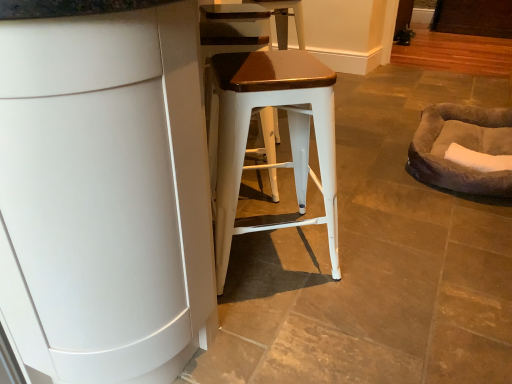
Question: Are white matte cabinet at center and matte white stool at center beside each other?

Choices:
 (A) yes
 (B) no

Answer: (B)

Question: Could matte white stool at center be considered to be inside white matte cabinet at center?

Choices:
 (A) no
 (B) yes

Answer: (B)

Question: From the image's perspective, is white matte cabinet at center beneath matte white stool at center?

Choices:
 (A) no
 (B) yes

Answer: (A)

Question: Considering the relative sizes of white matte cabinet at center and matte white stool at center in the image provided, is white matte cabinet at center smaller than matte white stool at center?

Choices:
 (A) yes
 (B) no

Answer: (B)

Question: Can you confirm if white matte cabinet at center is thinner than matte white stool at center?

Choices:
 (A) yes
 (B) no

Answer: (B)

Question: Can you confirm if white matte cabinet at center is bigger than matte white stool at center?

Choices:
 (A) no
 (B) yes

Answer: (B)

Question: Is matte white stool at center to the left of brown fuzzy bean bag at right from the viewer's perspective?

Choices:
 (A) yes
 (B) no

Answer: (A)

Question: Is matte white stool at center to the right of brown fuzzy bean bag at right from the viewer's perspective?

Choices:
 (A) yes
 (B) no

Answer: (B)

Question: From a real-world perspective, is matte white stool at center physically above brown fuzzy bean bag at right?

Choices:
 (A) yes
 (B) no

Answer: (A)

Question: From the image's perspective, is matte white stool at center beneath brown fuzzy bean bag at right?

Choices:
 (A) yes
 (B) no

Answer: (A)

Question: From the image's perspective, is matte white stool at center above brown fuzzy bean bag at right?

Choices:
 (A) yes
 (B) no

Answer: (B)

Question: Is matte white stool at center turned away from brown fuzzy bean bag at right?

Choices:
 (A) no
 (B) yes

Answer: (A)

Question: Can you confirm if white matte cabinet at center is taller than brown fuzzy bean bag at right?

Choices:
 (A) yes
 (B) no

Answer: (A)